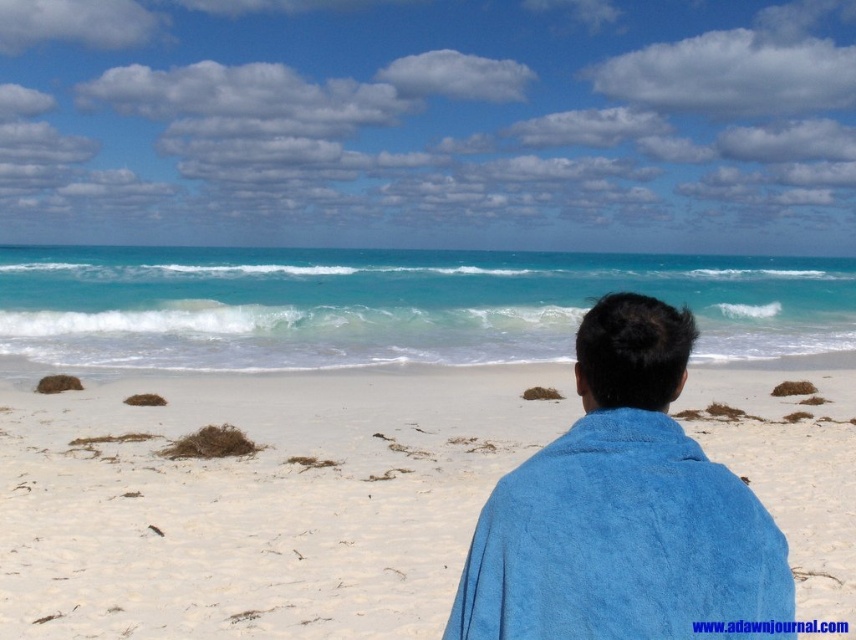
Question: Which object appears closest to the camera in this image?

Choices:
 (A) white sandy beach at center
 (B) blue towel at center

Answer: (B)

Question: Does white sandy beach at center have a greater width compared to blue towel at center?

Choices:
 (A) no
 (B) yes

Answer: (B)

Question: Considering the relative positions of white sandy beach at center and blue towel at center in the image provided, where is white sandy beach at center located with respect to blue towel at center?

Choices:
 (A) right
 (B) left

Answer: (B)

Question: Which point is farther to the camera?

Choices:
 (A) (661, 496)
 (B) (254, 404)

Answer: (B)

Question: Is white sandy beach at center closer to camera compared to blue towel at center?

Choices:
 (A) yes
 (B) no

Answer: (B)